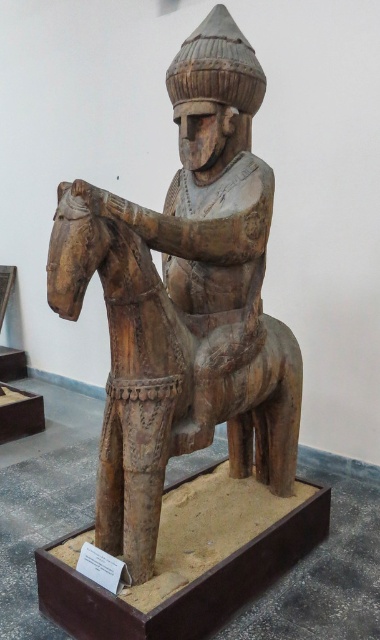
You are an art curator examining the wooden sculpture of the mounted warrior. You notice two main components at the center of the scene. Which object is bigger between the wooden horse at center and the wooden statue at center?

The wooden horse at center is larger in size than the wooden statue at center.

You are an art conservator examining the wooden sculpture. You notice the wooden horse at center and the wooden statue at center. Which object is positioned to the right of the other?

The wooden horse at center is to the right of the wooden statue at center according to the description.

You are an art conservator examining the wooden sculpture of the mounted warrior. You notice two points of interest marked on the sculpture at coordinates point (114, 349) and point (239, 294). From your vantage point, which of these two points is closer to you?

Point (114, 349) is in front of point (239, 294), so it is closer to you.